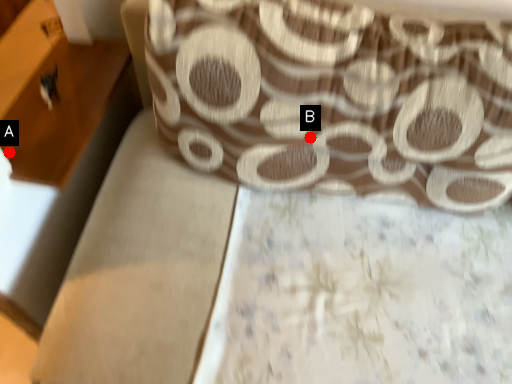
Question: Two points are circled on the image, labeled by A and B beside each circle. Which of the following is the farthest from the observer?

Choices:
 (A) A is further
 (B) B is further

Answer: (A)